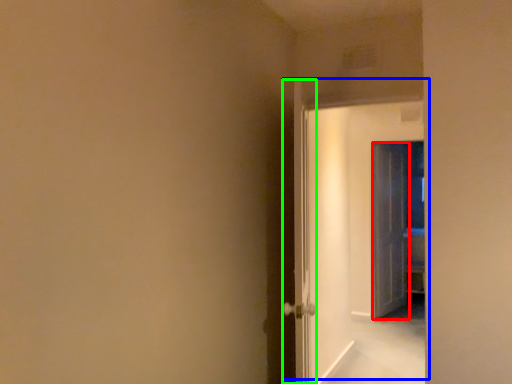
Question: Based on their relative distances, which object is farther from door (highlighted by a red box)? Choose from door (highlighted by a blue box) and door (highlighted by a green box).

Choices:
 (A) door
 (B) door

Answer: (B)